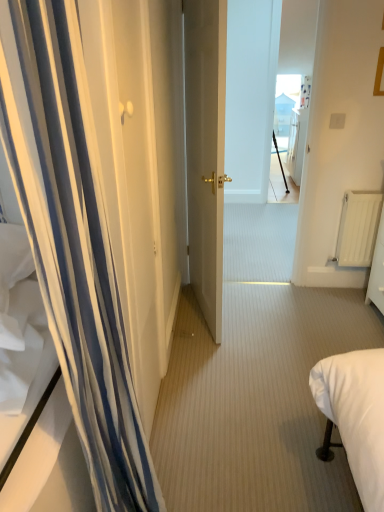
What is the approximate width of matte gold door at center?

5.19 inches.

Where is `white matte radiator at right`? This screenshot has height=512, width=384. white matte radiator at right is located at coordinates (358, 228).

What do you see at coordinates (76, 251) in the screenshot? The image size is (384, 512). I see `white striped curtain at left` at bounding box center [76, 251].

What is the approximate width of white striped curtain at left?

white striped curtain at left is 7.14 inches wide.

Where is `matte gold door at center`? The width and height of the screenshot is (384, 512). matte gold door at center is located at coordinates (206, 150).

Between white matte radiator at right and black matte tripod at center, which one has smaller width?

With smaller width is white matte radiator at right.

Is white matte radiator at right taller than black matte tripod at center?

Incorrect, the height of white matte radiator at right is not larger of that of black matte tripod at center.

How many degrees apart are the facing directions of white matte radiator at right and black matte tripod at center?

178 degrees separate the facing orientations of white matte radiator at right and black matte tripod at center.

From the picture: Does white matte radiator at right have a larger size compared to black matte tripod at center?

No, white matte radiator at right is not bigger than black matte tripod at center.

Is white striped curtain at left not inside white matte radiator at right?

Yes.

Considering the relative sizes of white striped curtain at left and white matte radiator at right in the image provided, is white striped curtain at left thinner than white matte radiator at right?

No, white striped curtain at left is not thinner than white matte radiator at right.

Looking at this image, who is bigger, white striped curtain at left or white matte radiator at right?

With larger size is white striped curtain at left.

Would you say white matte radiator at right is part of matte gold door at center's contents?

No, white matte radiator at right is not inside matte gold door at center.

How far apart are matte gold door at center and white matte radiator at right?

matte gold door at center is 3.36 feet from white matte radiator at right.

Is matte gold door at center not near white matte radiator at right?

Yes, matte gold door at center is far from white matte radiator at right.

Could you tell me if matte gold door at center is facing white matte radiator at right?

Yes, matte gold door at center is facing white matte radiator at right.

Looking at this image, does black matte tripod at center have a smaller size compared to white striped curtain at left?

Yes.

Does black matte tripod at center have a lesser height compared to white striped curtain at left?

Indeed, black matte tripod at center has a lesser height compared to white striped curtain at left.

Does black matte tripod at center have a lesser width compared to white striped curtain at left?

Correct, the width of black matte tripod at center is less than that of white striped curtain at left.

Is black matte tripod at center oriented away from white striped curtain at left?

black matte tripod at center does not have its back to white striped curtain at left.

From the image's perspective, is white matte radiator at right located beneath matte gold door at center?

Yes, from the image's perspective, white matte radiator at right is below matte gold door at center.

How much distance is there between white matte radiator at right and matte gold door at center?

They are 1.02 meters apart.

Is white matte radiator at right touching matte gold door at center?

No, white matte radiator at right is not next to matte gold door at center.

Considering the points (364, 206) and (223, 106), which point is behind, point (364, 206) or point (223, 106)?

Point (364, 206)

Is matte gold door at center not near black matte tripod at center?

Absolutely, matte gold door at center is distant from black matte tripod at center.

Could you tell me if matte gold door at center is turned towards black matte tripod at center?

No.

Considering the sizes of objects matte gold door at center and black matte tripod at center in the image provided, who is taller, matte gold door at center or black matte tripod at center?

Standing taller between the two is matte gold door at center.

Does matte gold door at center have a smaller size compared to black matte tripod at center?

Actually, matte gold door at center might be larger than black matte tripod at center.

Is white matte radiator at right completely or partially inside black matte tripod at center?

No, white matte radiator at right is located outside of black matte tripod at center.

Is black matte tripod at center bigger than white matte radiator at right?

Indeed, black matte tripod at center has a larger size compared to white matte radiator at right.

Which object is wider, black matte tripod at center or white matte radiator at right?

Wider between the two is black matte tripod at center.

In order to click on radiator below the black matte tripod at center (from the image's perspective) in this screenshot , I will do `click(358, 228)`.

At what (x,y) coordinates should I click in order to perform the action: click on radiator that appears below the white striped curtain at left (from a real-world perspective). Please return your answer as a coordinate pair (x, y). The width and height of the screenshot is (384, 512). Looking at the image, I should click on (358, 228).

From the image, which object appears to be nearer to white striped curtain at left, white matte radiator at right or matte gold door at center?

matte gold door at center is positioned closer to the anchor white striped curtain at left.

From the image, which object appears to be nearer to white matte radiator at right, matte gold door at center or white striped curtain at left?

matte gold door at center is closer to white matte radiator at right.

Based on their spatial positions, is white striped curtain at left or black matte tripod at center further from white matte radiator at right?

black matte tripod at center is positioned further to the anchor white matte radiator at right.

Based on their spatial positions, is black matte tripod at center or matte gold door at center closer to white striped curtain at left?

matte gold door at center lies closer to white striped curtain at left than the other object.

Which object lies further to the anchor point black matte tripod at center, matte gold door at center or white matte radiator at right?

Based on the image, matte gold door at center appears to be further to black matte tripod at center.

Looking at the image, which one is located further to matte gold door at center, white matte radiator at right or black matte tripod at center?

The object further to matte gold door at center is black matte tripod at center.

From the picture: Which object lies nearer to the anchor point white striped curtain at left, matte gold door at center or black matte tripod at center?

matte gold door at center.

Estimate the real-world distances between objects in this image. Which object is further from white striped curtain at left, matte gold door at center or white matte radiator at right?

Based on the image, white matte radiator at right appears to be further to white striped curtain at left.

This screenshot has height=512, width=384. Find the location of `radiator positioned between matte gold door at center and black matte tripod at center from near to far`. radiator positioned between matte gold door at center and black matte tripod at center from near to far is located at coordinates tap(358, 228).

Image resolution: width=384 pixels, height=512 pixels. In order to click on radiator between white striped curtain at left and black matte tripod at center from front to back in this screenshot , I will do `click(358, 228)`.

The width and height of the screenshot is (384, 512). Find the location of `door between white striped curtain at left and white matte radiator at right in the front-back direction`. door between white striped curtain at left and white matte radiator at right in the front-back direction is located at coordinates (206, 150).

This screenshot has width=384, height=512. Identify the location of door between white striped curtain at left and black matte tripod at center from front to back. (206, 150).